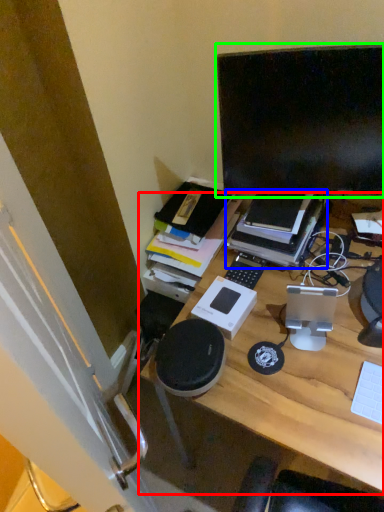
Question: Which object is positioned closest to desk (highlighted by a red box)? Select from book (highlighted by a blue box) and computer monitor (highlighted by a green box).

Choices:
 (A) book
 (B) computer monitor

Answer: (A)